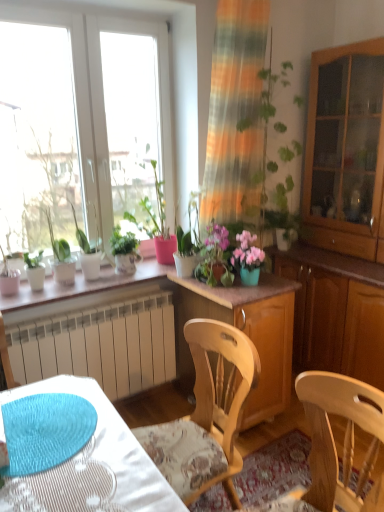
Question: Does wooden cabinet at right contain wooden chair at center?

Choices:
 (A) yes
 (B) no

Answer: (B)

Question: Can you confirm if wooden cabinet at right is positioned to the left of wooden chair at center?

Choices:
 (A) no
 (B) yes

Answer: (A)

Question: From a real-world perspective, is wooden cabinet at right over wooden chair at center?

Choices:
 (A) yes
 (B) no

Answer: (B)

Question: Can you confirm if wooden cabinet at right is smaller than wooden chair at center?

Choices:
 (A) no
 (B) yes

Answer: (A)

Question: Is wooden cabinet at right positioned beyond the bounds of wooden chair at center?

Choices:
 (A) yes
 (B) no

Answer: (A)

Question: Can you confirm if wooden cabinet at right is shorter than wooden chair at center?

Choices:
 (A) no
 (B) yes

Answer: (B)

Question: Is pink matte flower pot at center looking in the opposite direction of green matte plant at left, which is the second houseplant in right-to-left order?

Choices:
 (A) no
 (B) yes

Answer: (A)

Question: Can you confirm if pink matte flower pot at center is positioned to the left of green matte plant at left, which is the second houseplant in right-to-left order?

Choices:
 (A) yes
 (B) no

Answer: (B)

Question: From the image's perspective, is pink matte flower pot at center below green matte plant at left, acting as the 1th houseplant starting from the left?

Choices:
 (A) no
 (B) yes

Answer: (B)

Question: Is pink matte flower pot at center not within green matte plant at left, which is the second houseplant in right-to-left order?

Choices:
 (A) yes
 (B) no

Answer: (A)

Question: Is green matte plant at left, acting as the 1th houseplant starting from the left, located within pink matte flower pot at center?

Choices:
 (A) yes
 (B) no

Answer: (B)

Question: Is pink matte flower pot at center far away from green matte plant at left, which is the second houseplant in right-to-left order?

Choices:
 (A) no
 (B) yes

Answer: (A)

Question: From the image's perspective, is wooden cabinet at right, which is the 1th cabinetry from top to bottom, above green matte plant at upper left, positioned as the 2th houseplant in left-to-right order?

Choices:
 (A) no
 (B) yes

Answer: (B)